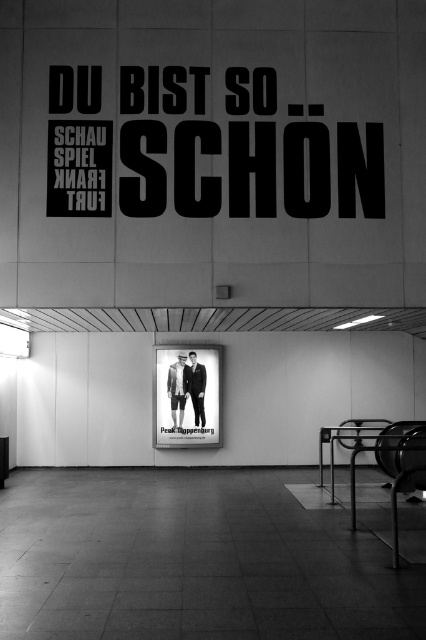
You are standing in a public space and see the matte black poster at center and the dark gray suit at center. Which object is nearer to you?

The matte black poster at center is closer to the viewer than the dark gray suit at center.